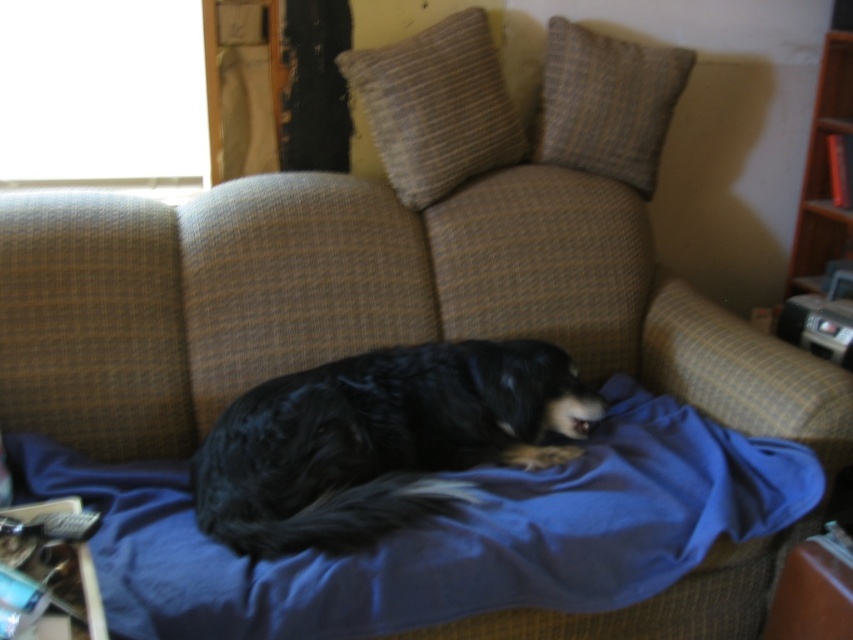
Which of these two, black fur dog at center or textured beige pillow at upper center, stands shorter?

black fur dog at center

Does black fur dog at center appear over textured beige pillow at upper center?

Incorrect, black fur dog at center is not positioned above textured beige pillow at upper center.

The width and height of the screenshot is (853, 640). What do you see at coordinates (380, 440) in the screenshot?
I see `black fur dog at center` at bounding box center [380, 440].

At what (x,y) coordinates should I click in order to perform the action: click on black fur dog at center. Please return your answer as a coordinate pair (x, y). The height and width of the screenshot is (640, 853). Looking at the image, I should click on (380, 440).

Is point (386, 156) less distant than point (833, 108)?

Yes, point (386, 156) is in front of point (833, 108).

Is textured beige pillow at upper center thinner than wooden bookshelf at right?

No.

What do you see at coordinates (436, 106) in the screenshot? This screenshot has height=640, width=853. I see `textured beige pillow at upper center` at bounding box center [436, 106].

The image size is (853, 640). Find the location of `textured beige pillow at upper center`. textured beige pillow at upper center is located at coordinates (436, 106).

What do you see at coordinates (380, 440) in the screenshot? I see `black fur dog at center` at bounding box center [380, 440].

Is the position of black fur dog at center less distant than that of textured beige pillow at upper right?

Yes.

Identify the location of black fur dog at center. (380, 440).

This screenshot has height=640, width=853. I want to click on black fur dog at center, so click(380, 440).